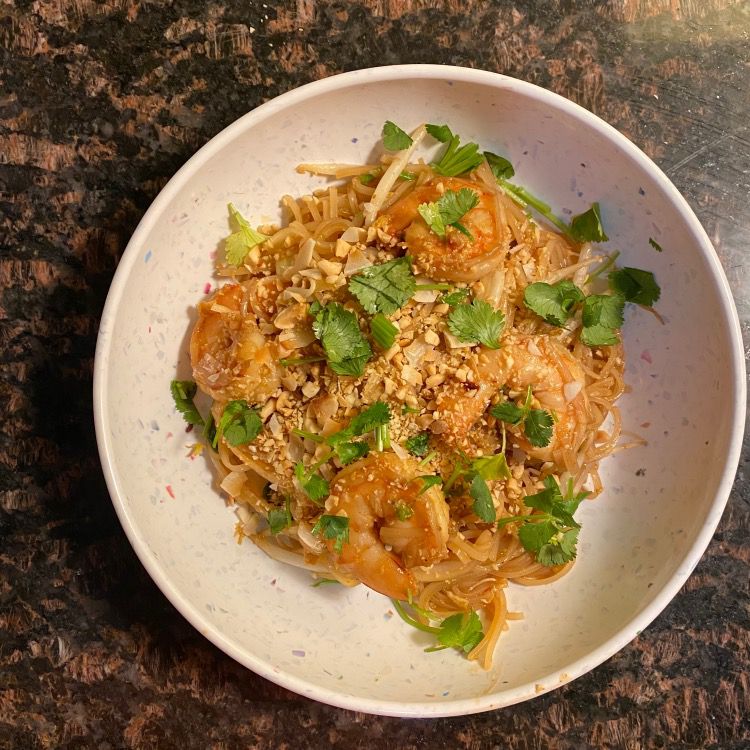
Image resolution: width=750 pixels, height=750 pixels. I want to click on granite tabletop upper left, so click(100, 87).